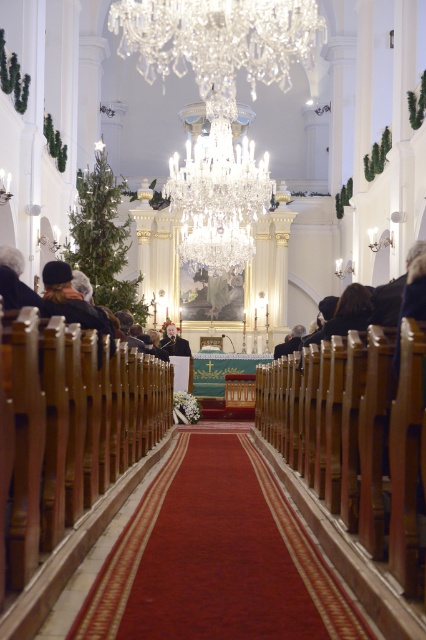
You are attending a wedding ceremony in the church and see the carpeted aisle at center and the dark brown leather jacket at left. Which object is positioned to the right of the other?

The carpeted aisle at center is to the right of dark brown leather jacket at left.

You are attending a ceremony in the church and need to walk from the entrance to the altar. You see the carpeted aisle at center and the smooth black jacket at center. Which object should you avoid stepping on to stay on the correct path?

The carpeted aisle at center is positioned on the right side of smooth black jacket at center. To stay on the correct path, you should avoid stepping on the smooth black jacket at center and follow the carpeted aisle at center towards the altar.